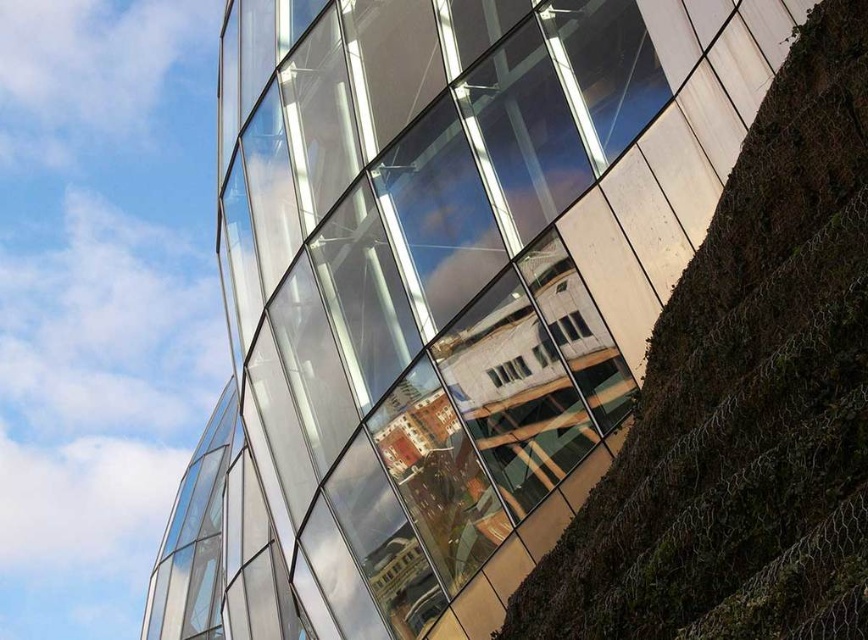
You are an architect planning to install a new sculpture between the transparent glass windows at center and the green mossy hillside at right. The sculpture requires a minimum of 20 meters of space. Is there enough space between them to accommodate the sculpture?

The transparent glass windows at center and green mossy hillside at right are 25.10 meters apart, which is more than the required 20 meters. Therefore, there is sufficient space to install the sculpture between them.

You are standing in front of the modern architectural structure. Where are the transparent glass windows at center located in terms of their 2D coordinates?

The transparent glass windows at center are located at the 2D coordinates of point (428,298).

You are standing in front of the modern architectural structure described. You notice a point marked at coordinates (428,298). What object does this point correspond to?

The point at coordinates (428,298) corresponds to the transparent glass windows at center.